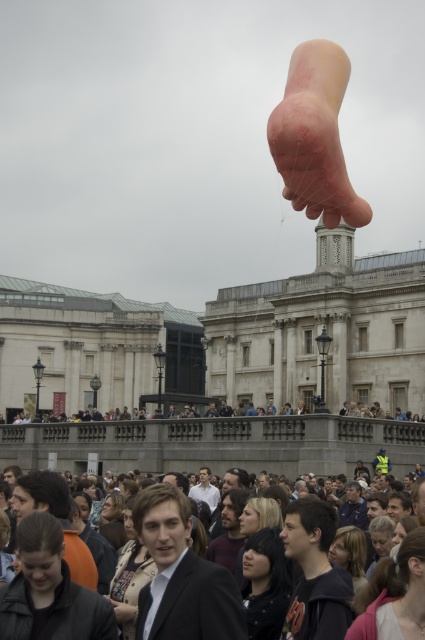
Does point (314, 310) lie behind point (302, 108)?

Yes, point (314, 310) is behind point (302, 108).

Is white stone building at center bigger than pink rubber foot at upper center?

No.

Who is more distant from viewer, (243,385) or (314,170)?

Point (243,385)

At what (x,y) coordinates should I click in order to perform the action: click on white stone building at center. Please return your answer as a coordinate pair (x, y). Image resolution: width=425 pixels, height=640 pixels. Looking at the image, I should click on (322, 328).

Between point (289, 104) and point (317, 621), which one is positioned behind?

The point (289, 104) is behind.

Is pink rubber foot at upper center wider than matte black suit at center?

No, pink rubber foot at upper center is not wider than matte black suit at center.

Describe the element at coordinates (314, 136) in the screenshot. I see `pink rubber foot at upper center` at that location.

The height and width of the screenshot is (640, 425). Identify the location of pink rubber foot at upper center. (314, 136).

Can you confirm if white stone building at center is thinner than matte black suit at center?

Incorrect, white stone building at center's width is not less than matte black suit at center's.

Can you confirm if white stone building at center is wider than matte black suit at center?

Yes.

The image size is (425, 640). In order to click on white stone building at center in this screenshot , I will do point(322,328).